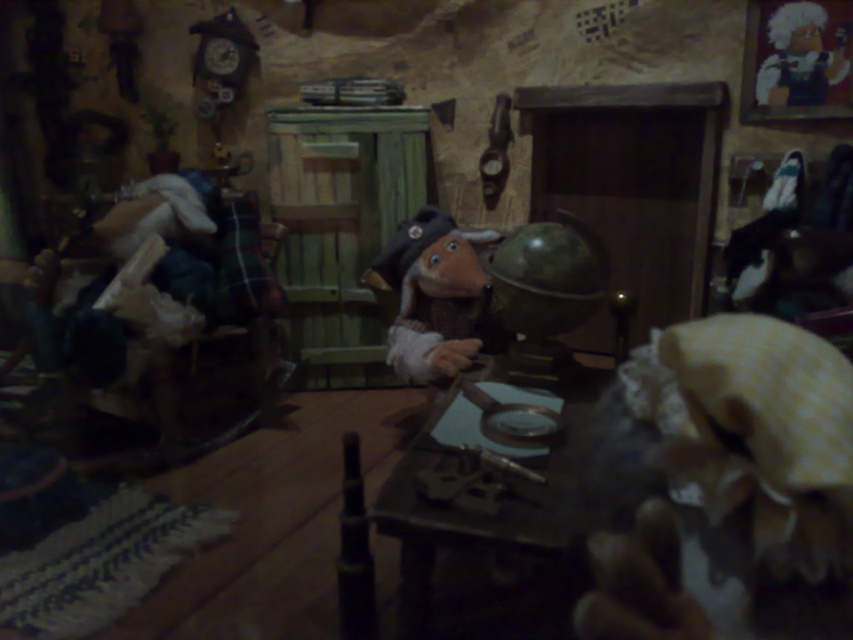
You are a small toy soldier standing on the floor. You want to climb onto the wooden table at center and then onto the matte brown wooden toy at center. Which object will require you to climb higher?

The matte brown wooden toy at center is taller than the wooden table at center, so you will need to climb higher to reach the matte brown wooden toy at center.

Consider the image. You are a small toy trying to move from the wooden table at center to the matte brown wooden toy at center. Can you fit through the space between them?

The wooden table at center is wider than the matte brown wooden toy at center, so there might not be enough space for the toy to pass through. It depends on the exact dimensions and arrangement, but given the table is wider, it could block the path.

You are a small toy mouse that is 2 inches long. You want to move from the wooden table at center to the matte brown wooden toy at center. Can you fit through the space between them?

The distance between the wooden table at center and the matte brown wooden toy at center is 27.59 inches, which is more than enough for a 2 inch long toy mouse to move through.